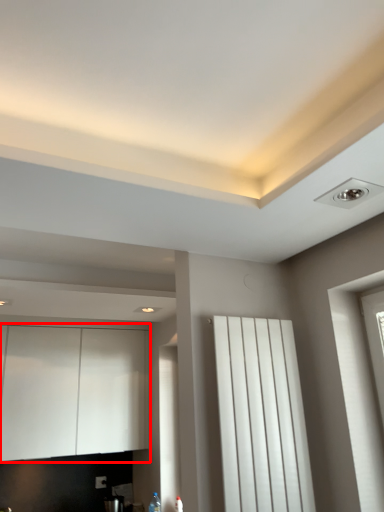
Question: In this image, where is cabinetry (annotated by the red box) located relative to curtain?

Choices:
 (A) right
 (B) left

Answer: (B)